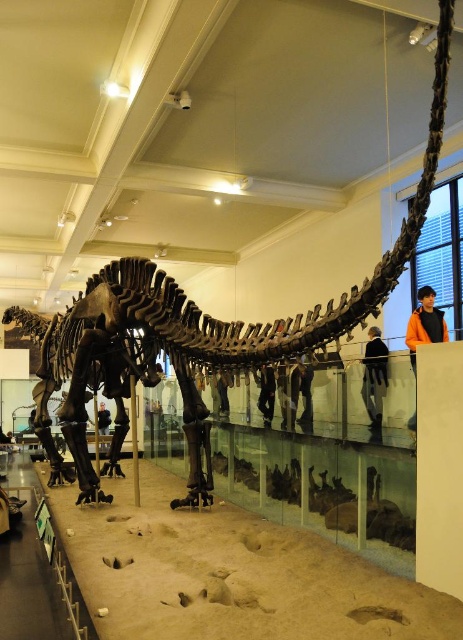
Is black fabric at upper center shorter than matte black dinosaur at lower left?

Yes.

Does black fabric at upper center appear on the right side of matte black dinosaur at lower left?

Indeed, black fabric at upper center is positioned on the right side of matte black dinosaur at lower left.

At what (x,y) coordinates should I click in order to perform the action: click on black fabric at upper center. Please return your answer as a coordinate pair (x, y). Looking at the image, I should click on (375, 378).

From the picture: Is orange sweater at upper right bigger than matte black dinosaur at lower left?

Correct, orange sweater at upper right is larger in size than matte black dinosaur at lower left.

In the scene shown: Can you confirm if orange sweater at upper right is thinner than matte black dinosaur at lower left?

Incorrect, orange sweater at upper right's width is not less than matte black dinosaur at lower left's.

Which is in front, point (430, 316) or point (104, 432)?

Positioned in front is point (430, 316).

What are the coordinates of `orange sweater at upper right` in the screenshot? It's located at (425, 324).

This screenshot has height=640, width=463. What do you see at coordinates (223, 392) in the screenshot?
I see `black fabric at lower center` at bounding box center [223, 392].

Is black fabric at lower center to the right of matte black dinosaur at lower left from the viewer's perspective?

Indeed, black fabric at lower center is positioned on the right side of matte black dinosaur at lower left.

At what (x,y) coordinates should I click in order to perform the action: click on black fabric at lower center. Please return your answer as a coordinate pair (x, y). Looking at the image, I should click on (223, 392).

Find the location of a particular element. The image size is (463, 640). black fabric at lower center is located at coordinates (223, 392).